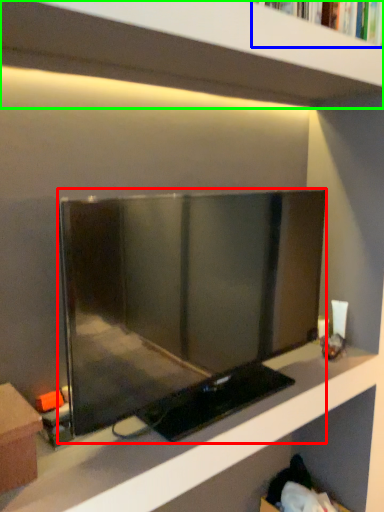
Question: Based on their relative distances, which object is nearer to television (highlighted by a red box)? Choose from book (highlighted by a blue box) and shelf (highlighted by a green box).

Choices:
 (A) book
 (B) shelf

Answer: (B)